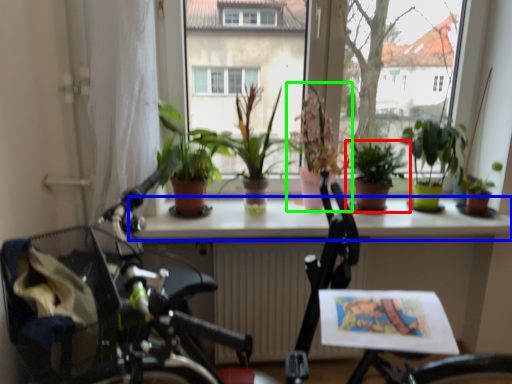
Question: Which is farther away from houseplant (highlighted by a red box)? window sill (highlighted by a blue box) or houseplant (highlighted by a green box)?

Choices:
 (A) window sill
 (B) houseplant

Answer: (A)